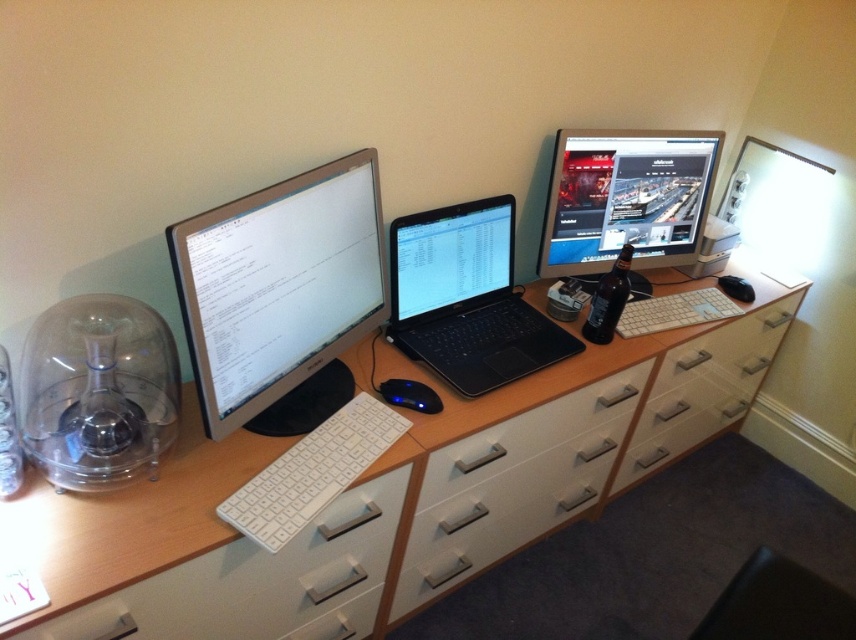
You are setting up a video call and need to position your camera so that it faces the satin black monitor at left. The recommended distance between the camera and the monitor is 36 inches for optimal framing. Is the current distance sufficient?

The satin black monitor at left and camera are 38.25 inches apart from each other, which is slightly more than the recommended 36 inches. The distance is sufficient but may result in a slightly wider frame than intended.